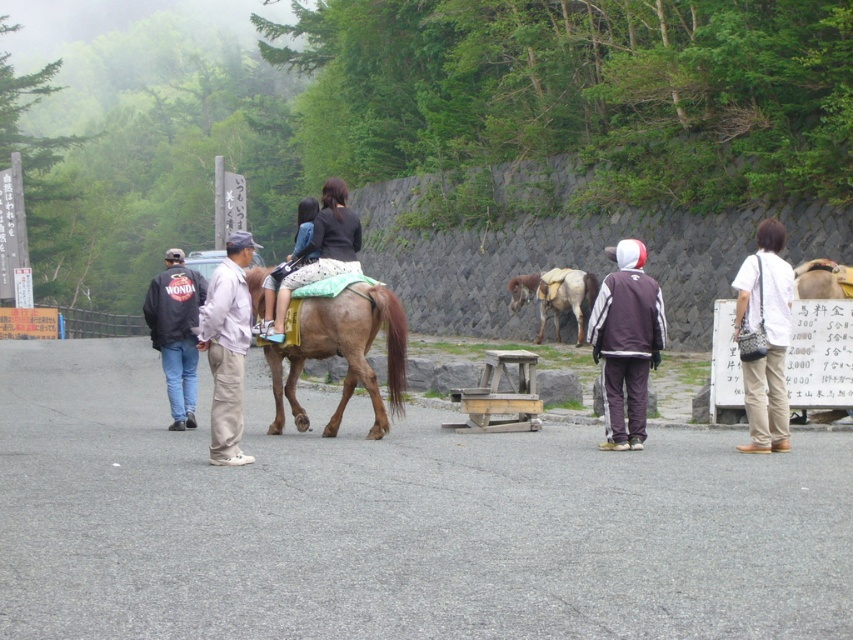
Can you confirm if light brown cotton pants at center is smaller than brown leather saddle at center?

Yes, light brown cotton pants at center is smaller than brown leather saddle at center.

Is light brown cotton pants at center to the right of brown leather saddle at center from the viewer's perspective?

Incorrect, light brown cotton pants at center is not on the right side of brown leather saddle at center.

Which is behind, point (236, 304) or point (540, 296)?

The point (540, 296) is behind.

Locate an element on the screen. This screenshot has width=853, height=640. light brown cotton pants at center is located at coordinates (227, 348).

Looking at this image, is the position of light brown cotton pants at center less distant than that of matte black jacket at center?

Yes, light brown cotton pants at center is in front of matte black jacket at center.

Can you confirm if light brown cotton pants at center is positioned below matte black jacket at center?

Yes, light brown cotton pants at center is below matte black jacket at center.

You are a GUI agent. You are given a task and a screenshot of the screen. Output one action in this format:
    pyautogui.click(x=<x>, y=<y>)
    Task: Click on the light brown cotton pants at center
    
    Given the screenshot: What is the action you would take?
    pyautogui.click(x=227, y=348)

Who is shorter, brown horse at center or brown velour jacket at center?

brown horse at center

Does brown horse at center have a lesser height compared to brown velour jacket at center?

Correct, brown horse at center is not as tall as brown velour jacket at center.

Who is more forward, (799, 593) or (659, 326)?

Point (799, 593) is in front.

You are a GUI agent. You are given a task and a screenshot of the screen. Output one action in this format:
    pyautogui.click(x=<x>, y=<y>)
    Task: Click on the brown horse at center
    
    Given the screenshot: What is the action you would take?
    pyautogui.click(x=393, y=522)